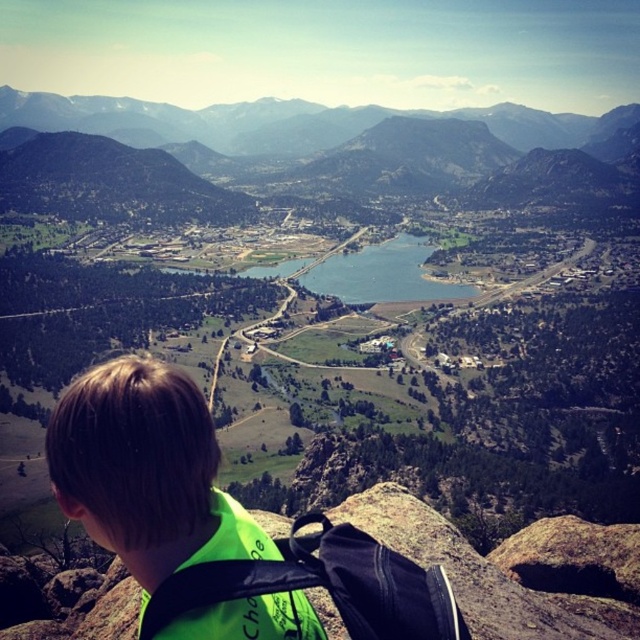
You are a hiker who wants to ensure your belongings are visible to others for safety. Which of the following items would be more noticeable to someone approaching from behind you? The neon green backpack at lower left or the neon green fabric safety vest at lower left?

The neon green backpack at lower left has a larger size compared to the neon green fabric safety vest at lower left, so the neon green backpack at lower left would be more noticeable to someone approaching from behind you.

Based on the scene description, what does the point at coordinates (x=368, y=147) represent?

The point at coordinates (x=368, y=147) represents the green grassy mountain at upper center.

Looking at this image, you are a hiker standing at the base of the green grassy mountain at upper center and want to reach the neon green fabric safety vest at lower left. Which direction should you move to get there?

You should move downward from the green grassy mountain at upper center to reach the neon green fabric safety vest at lower left since it is positioned below the mountain.